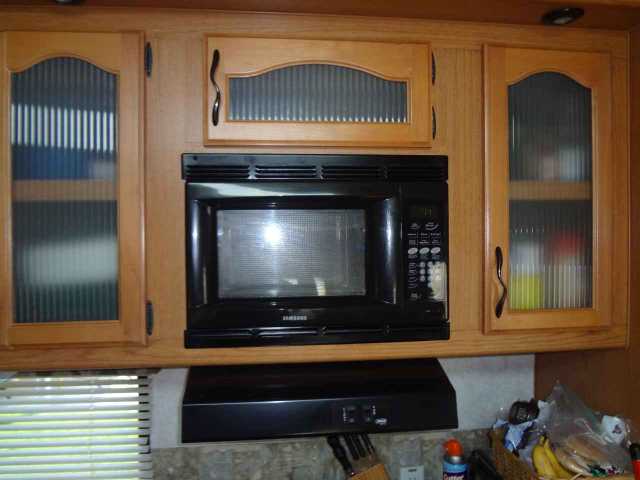
The image size is (640, 480). Identify the location of 1 middle cabinet. (355, 127).